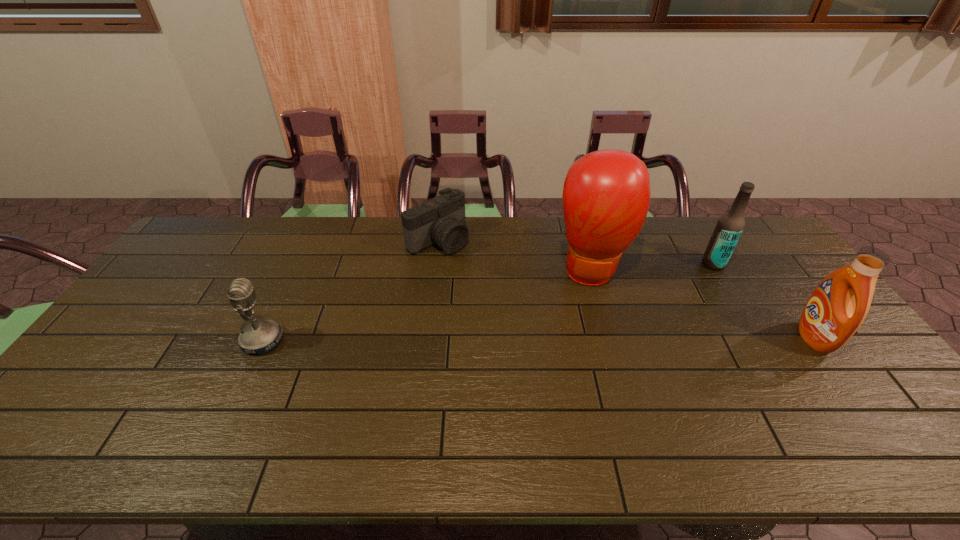
Identify the location of the leftmost object. (261, 336).

At what (x,y) coordinates should I click in order to perform the action: click on the fourth tallest object. Please return your answer as a coordinate pair (x, y). The width and height of the screenshot is (960, 540). Looking at the image, I should click on (261, 336).

Find the location of a particular element. The image size is (960, 540). detergent is located at coordinates (838, 306).

Where is `the third object from right to left`? The height and width of the screenshot is (540, 960). the third object from right to left is located at coordinates (606, 194).

You are a GUI agent. You are given a task and a screenshot of the screen. Output one action in this format:
    pyautogui.click(x=<x>, y=<y>)
    Task: Click on the boxing glove
    Image resolution: width=960 pixels, height=540 pixels.
    Given the screenshot: What is the action you would take?
    pyautogui.click(x=606, y=194)

Identify the location of the second object from right to left. The width and height of the screenshot is (960, 540). click(x=730, y=225).

I want to click on the shortest object, so (441, 220).

Image resolution: width=960 pixels, height=540 pixels. I want to click on camera, so click(x=441, y=220).

Image resolution: width=960 pixels, height=540 pixels. What are the coordinates of `free location located on the front-facing side of the leftmost object` in the screenshot? It's located at (305, 340).

At what (x,y) coordinates should I click in order to perform the action: click on free space located on the front-facing side of the detergent. Please return your answer as a coordinate pair (x, y). Looking at the image, I should click on (665, 338).